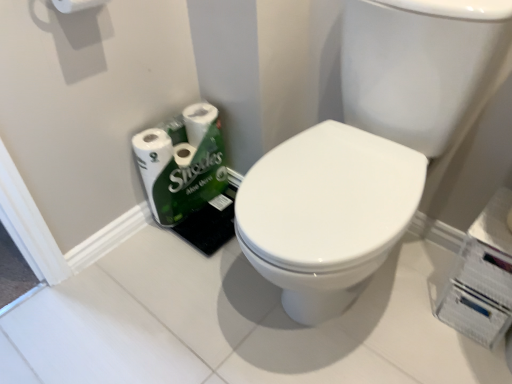
Identify the location of free space that is to the left of white glossy sink at center. The width and height of the screenshot is (512, 384). (176, 296).